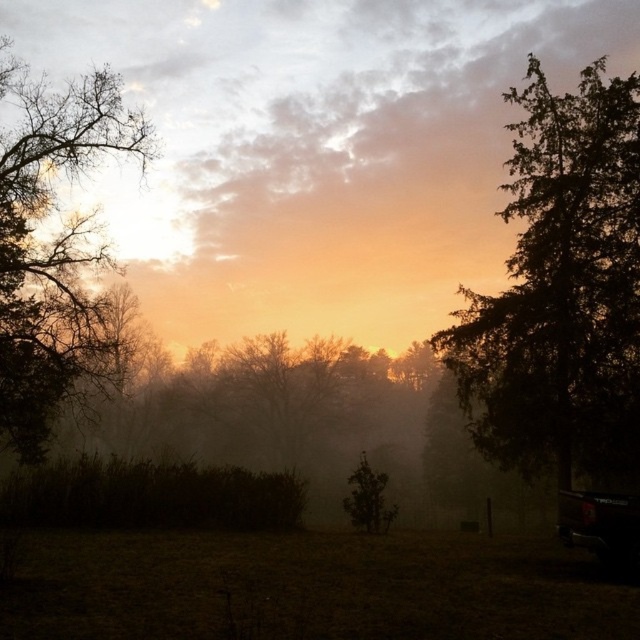
What are the coordinates of the bare branches at left in the image?

The coordinates of the bare branches at left are at point (x=52, y=248).